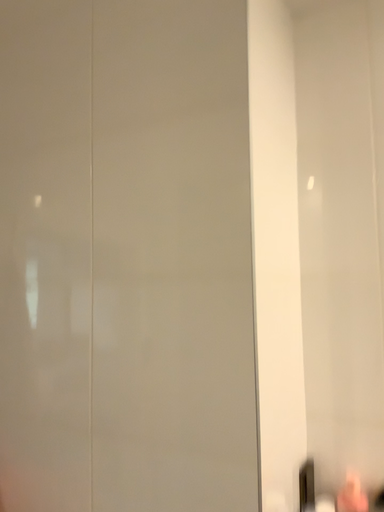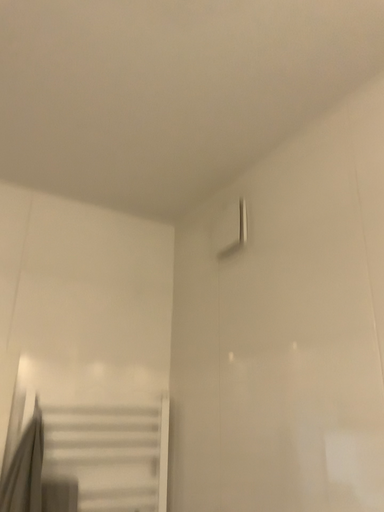
Question: How did the camera likely rotate when shooting the video?

Choices:
 (A) rotated left
 (B) rotated right

Answer: (A)